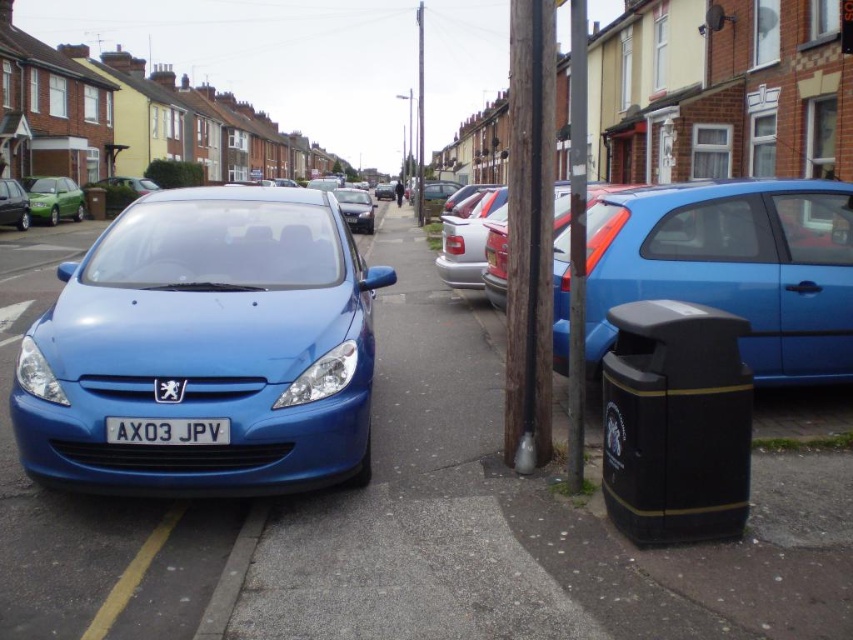
Is gray concrete curb at lower left positioned in front of satin black sedan at center?

Yes, gray concrete curb at lower left is in front of satin black sedan at center.

Between gray concrete curb at lower left and satin black sedan at center, which one is positioned higher?

satin black sedan at center is above.

Between point (248, 525) and point (346, 211), which one is positioned in front?

Point (248, 525) is in front.

Image resolution: width=853 pixels, height=640 pixels. Identify the location of gray concrete curb at lower left. (231, 573).

Is point (543, 456) less distant than point (6, 224)?

Yes, it is in front of point (6, 224).

Can you confirm if brown wooden pole at center-right is smaller than matte blue hatchback at left?

Yes.

Who is more forward, (527, 355) or (19, 198)?

Point (527, 355) is more forward.

Locate an element on the screen. brown wooden pole at center-right is located at coordinates (526, 234).

Can you confirm if matte blue car at left is shorter than green matte sedan at left?

Yes, matte blue car at left is shorter than green matte sedan at left.

Does point (323, 352) lie in front of point (47, 200)?

Yes, point (323, 352) is in front of point (47, 200).

Is point (367, 451) farther from camera compared to point (78, 196)?

No, (367, 451) is in front of (78, 196).

This screenshot has height=640, width=853. Identify the location of matte blue car at left. (206, 346).